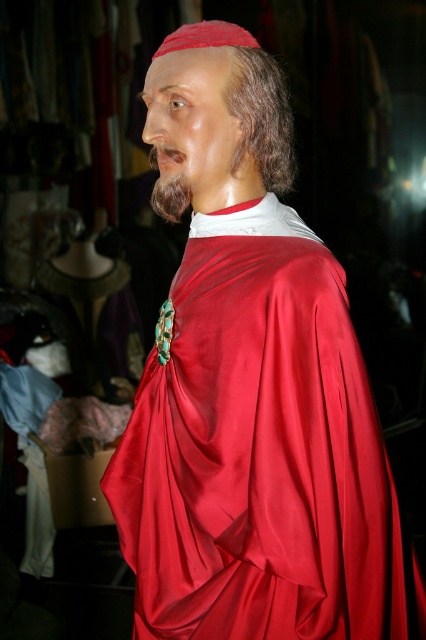
Question: In this image, where is satin red robe at center located relative to brown fuzzy beard at center?

Choices:
 (A) above
 (B) below

Answer: (B)

Question: Which is farther from the brown fuzzy beard at center?

Choices:
 (A) dark brown silky hair at upper center
 (B) satin red robe at center

Answer: (B)

Question: Based on their relative distances, which object is farther from the dark brown silky hair at upper center?

Choices:
 (A) satin red robe at center
 (B) brown fuzzy beard at center

Answer: (A)

Question: Which is nearer to the dark brown silky hair at upper center?

Choices:
 (A) satin red robe at center
 (B) brown fuzzy beard at center

Answer: (B)

Question: Is the position of satin red robe at center less distant than that of dark brown silky hair at upper center?

Choices:
 (A) no
 (B) yes

Answer: (B)

Question: Where is satin red robe at center located in relation to dark brown silky hair at upper center in the image?

Choices:
 (A) right
 (B) left

Answer: (B)